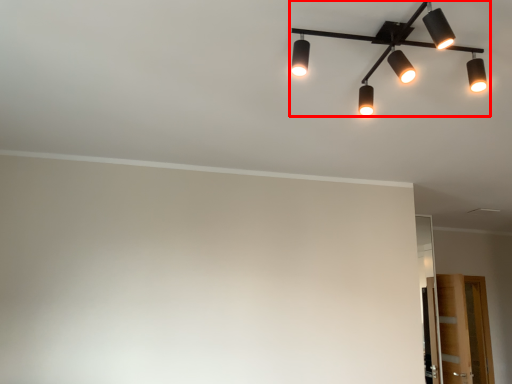
Question: Observing the image, what is the correct spatial positioning of lamp (annotated by the red box) in reference to glass door?

Choices:
 (A) right
 (B) left

Answer: (B)